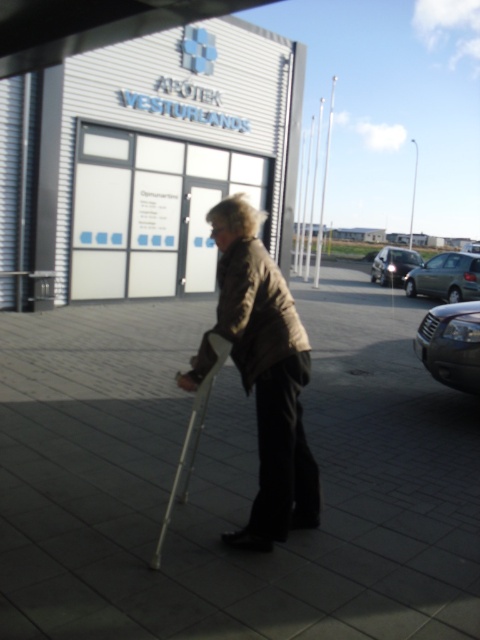
Question: Does shiny metallic car at right have a larger size compared to metallic gray sedan at right?

Choices:
 (A) no
 (B) yes

Answer: (B)

Question: Based on their relative distances, which object is nearer to the white plastic crutch at center?

Choices:
 (A) shiny metallic car at right
 (B) metallic gray sedan at right
 (C) silver metallic car at right
 (D) gray concrete pavement at center

Answer: (D)

Question: Which object is positioned farthest from the white plastic crutch at center?

Choices:
 (A) silver metallic car at right
 (B) shiny metallic car at right
 (C) brown matte jacket at center

Answer: (A)

Question: Which object is the farthest from the white plastic crutch at center?

Choices:
 (A) metallic gray sedan at right
 (B) silver metallic car at right
 (C) shiny metallic car at right

Answer: (B)

Question: Can you confirm if gray concrete pavement at center is bigger than shiny metallic car at right?

Choices:
 (A) no
 (B) yes

Answer: (B)

Question: Does brown matte jacket at center appear on the left side of silver metallic car at right?

Choices:
 (A) no
 (B) yes

Answer: (B)